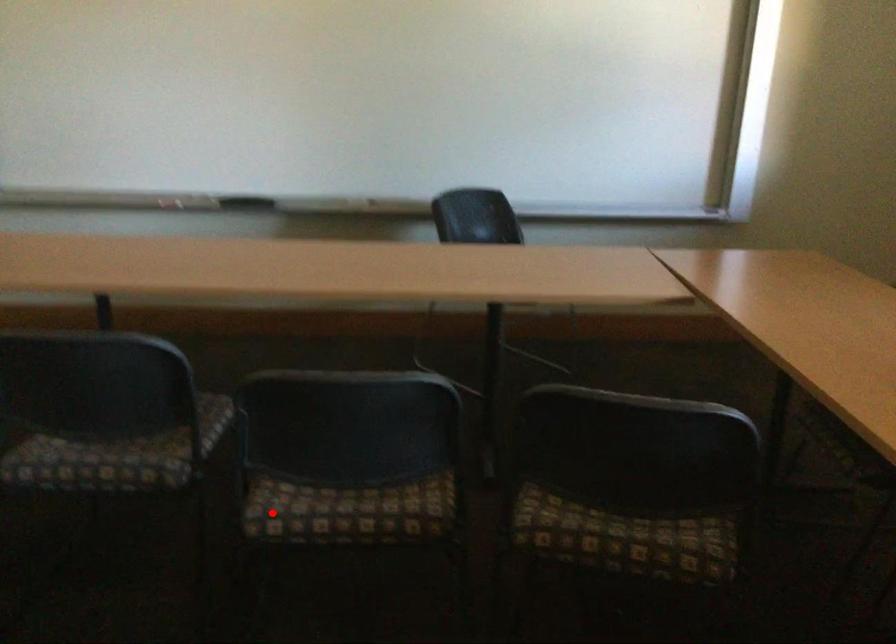
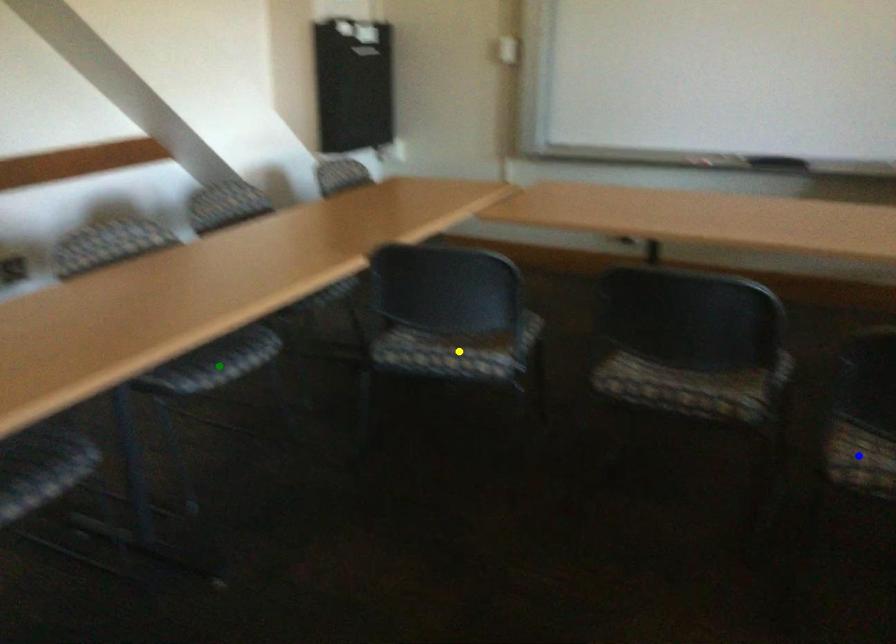
Question: I am providing you with two images of the same scene from different viewpoints. A red point is marked on the first image. You are given multiple points on the second image. Can you choose the point in image 2 that corresponds to the point in image 1?

Choices:
 (A) yellow point
 (B) green point
 (C) blue point

Answer: (C)